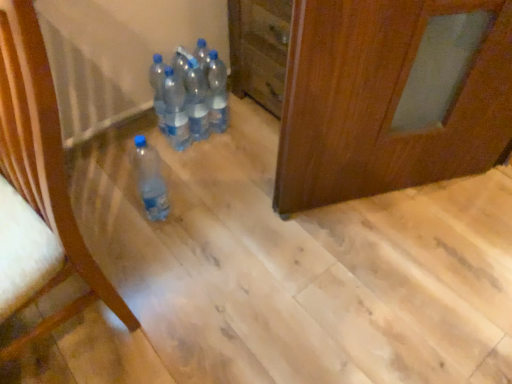
Image resolution: width=512 pixels, height=384 pixels. In order to click on free spot in front of transparent plastic bottles at center, the third bottle positioned from the left in this screenshot , I will do (x=180, y=178).